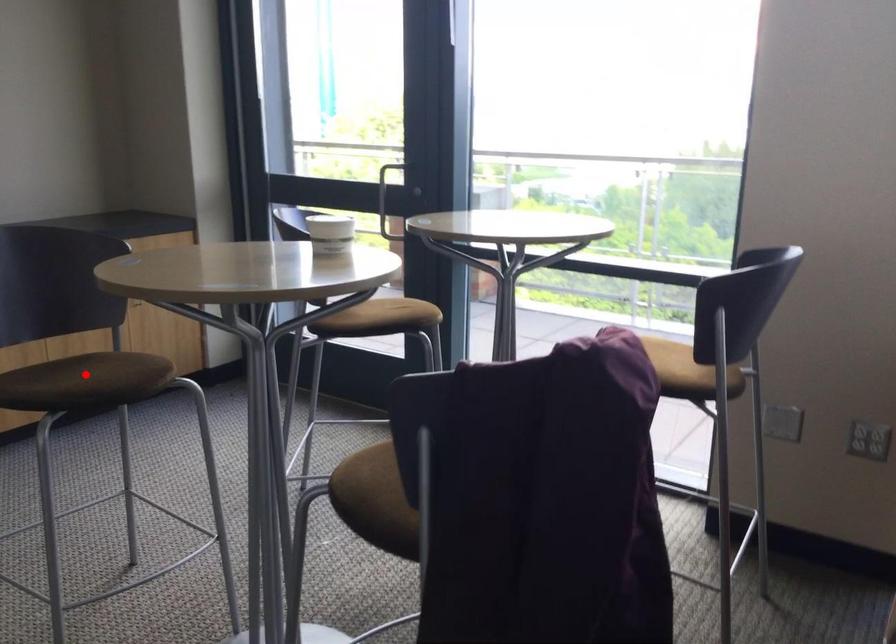
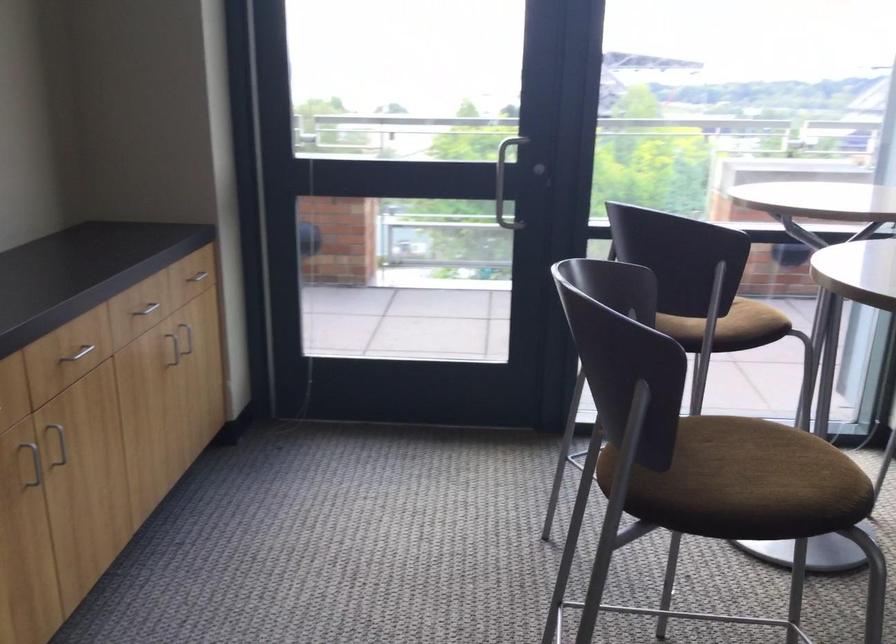
Question: I am providing you with two images of the same scene from different viewpoints. Image1 has a red point marked. In image2, the corresponding 3D location appears at what relative position? Reply with the corresponding letter.

Choices:
 (A) Closer
 (B) Farther

Answer: (A)